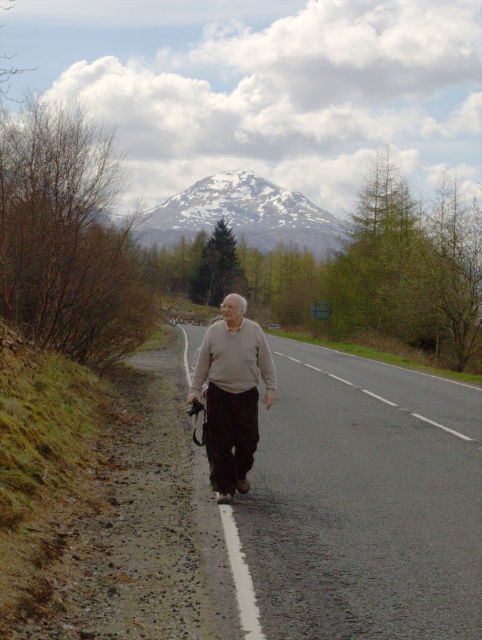
You are standing at point (226, 458) and want to walk to point (139, 237). Which direction should you face to walk towards your destination?

You should face towards the direction opposite of point (226, 458) since point (139, 237) is behind it.

You are a photographer standing on the road and want to take a photo of the snowy peak at upper center and the sweater at center. Which object should you focus on first if you want to capture both in sharp focus?

The snowy peak at upper center is further to the viewer than the sweater at center, so you should focus on the sweater at center first to ensure both are in sharp focus.